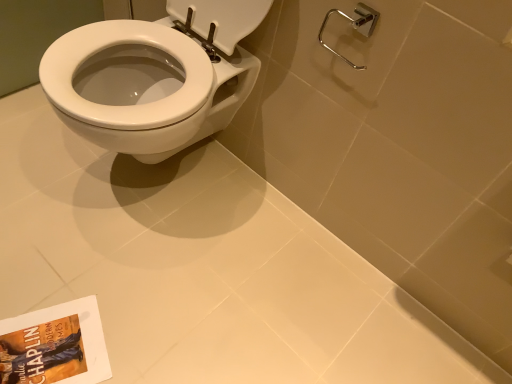
Question: From the image's perspective, relative to polished chrome shower at upper right, is matte paper book at lower left above or below?

Choices:
 (A) above
 (B) below

Answer: (B)

Question: Considering the positions of matte paper book at lower left and polished chrome shower at upper right in the image, is matte paper book at lower left taller or shorter than polished chrome shower at upper right?

Choices:
 (A) tall
 (B) short

Answer: (B)

Question: Which is correct: matte paper book at lower left is inside polished chrome shower at upper right, or outside of it?

Choices:
 (A) outside
 (B) inside

Answer: (A)

Question: From a real-world perspective, is polished chrome shower at upper right positioned above or below matte paper book at lower left?

Choices:
 (A) below
 (B) above

Answer: (B)

Question: Considering the positions of point (351, 18) and point (40, 312), is point (351, 18) closer or farther from the camera than point (40, 312)?

Choices:
 (A) farther
 (B) closer

Answer: (B)

Question: From the image's perspective, is polished chrome shower at upper right above or below matte paper book at lower left?

Choices:
 (A) above
 (B) below

Answer: (A)

Question: Is polished chrome shower at upper right to the left or to the right of matte paper book at lower left in the image?

Choices:
 (A) right
 (B) left

Answer: (A)